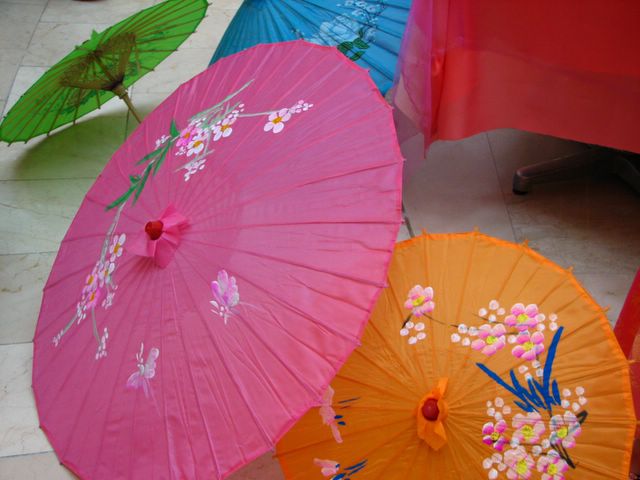
This screenshot has height=480, width=640. I want to click on table leg, so tap(550, 174).